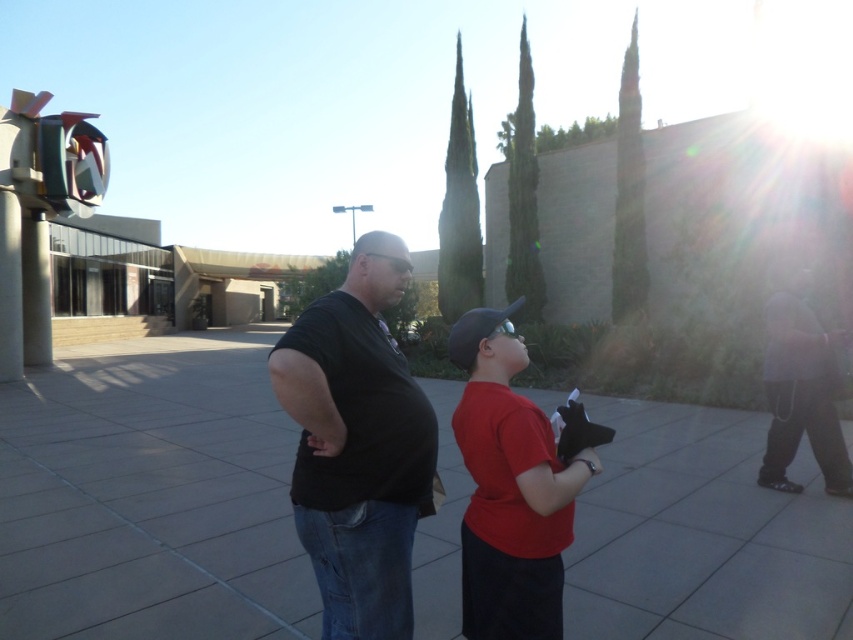
Does gray concrete pavement at center appear under red matte shirt at center?

Yes.

From the picture: Who is more distant from viewer, (743, 515) or (515, 397)?

Positioned behind is point (743, 515).

This screenshot has width=853, height=640. What are the coordinates of `gray concrete pavement at center` in the screenshot? It's located at (151, 496).

The image size is (853, 640). What do you see at coordinates (357, 445) in the screenshot?
I see `black matte shirt at center` at bounding box center [357, 445].

Can you confirm if black matte shirt at center is positioned to the left of red matte shirt at center?

Indeed, black matte shirt at center is positioned on the left side of red matte shirt at center.

Where is `black matte shirt at center`? black matte shirt at center is located at coordinates [357, 445].

Where is `black matte shirt at center`? The height and width of the screenshot is (640, 853). black matte shirt at center is located at coordinates (357, 445).

Which is more to the right, gray concrete pavement at center or black matte shirt at center?

Positioned to the right is black matte shirt at center.

Does gray concrete pavement at center come behind black matte shirt at center?

Yes, gray concrete pavement at center is behind black matte shirt at center.

I want to click on gray concrete pavement at center, so click(151, 496).